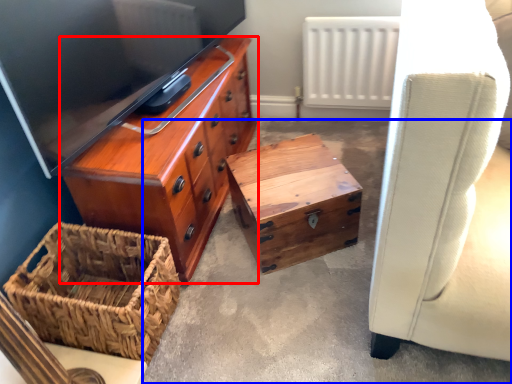
Question: Which point is closer to the camera, chest of drawers (highlighted by a red box) or concrete (highlighted by a blue box)?

Choices:
 (A) chest of drawers
 (B) concrete

Answer: (B)